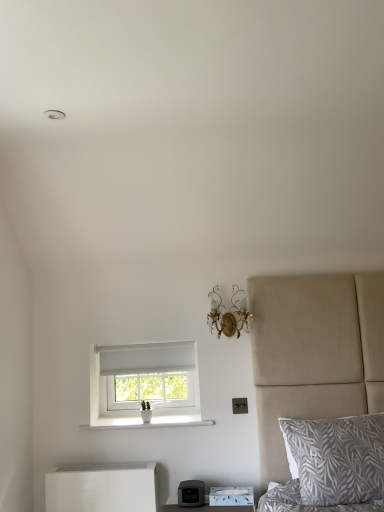
Question: Looking at their shapes, would you say white matte nightstand at lower left is wider or thinner than white fabric window at center?

Choices:
 (A) wide
 (B) thin

Answer: (B)

Question: In terms of height, does white matte nightstand at lower left look taller or shorter compared to white fabric window at center?

Choices:
 (A) short
 (B) tall

Answer: (A)

Question: Estimate the real-world distances between objects in this image. Which object is closer to the gray leaf-patterned pillow at lower right?

Choices:
 (A) white fabric window at center
 (B) gold crystal sconce at upper center
 (C) white ceramic vase at lower center
 (D) white matte nightstand at lower left
 (E) matte black printer at lower center

Answer: (E)

Question: Considering the real-world distances, which object is farthest from the matte black printer at lower center?

Choices:
 (A) gold crystal sconce at upper center
 (B) white ceramic vase at lower center
 (C) white fabric window at center
 (D) gray leaf-patterned pillow at lower right
 (E) white matte nightstand at lower left

Answer: (A)